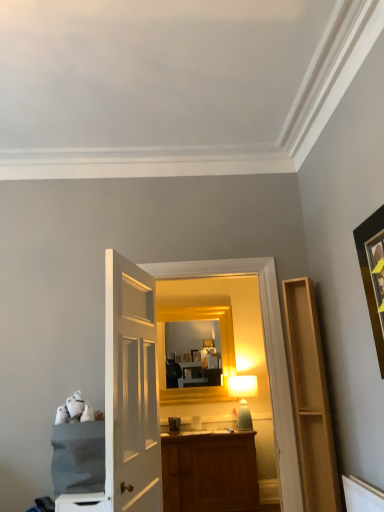
Question: From a real-world perspective, does light wood shelf at right, acting as the 1th cabinetry starting from the right, stand above black matte picture frame at upper right?

Choices:
 (A) yes
 (B) no

Answer: (B)

Question: Can you confirm if light wood shelf at right, acting as the 2th cabinetry starting from the left, is taller than black matte picture frame at upper right?

Choices:
 (A) no
 (B) yes

Answer: (B)

Question: Is light wood shelf at right, acting as the 2th cabinetry starting from the left, bigger than black matte picture frame at upper right?

Choices:
 (A) yes
 (B) no

Answer: (A)

Question: Is light wood shelf at right, acting as the 2th cabinetry starting from the left, positioned beyond the bounds of black matte picture frame at upper right?

Choices:
 (A) no
 (B) yes

Answer: (B)

Question: Can you confirm if light wood shelf at right, acting as the 2th cabinetry starting from the left, is shorter than black matte picture frame at upper right?

Choices:
 (A) yes
 (B) no

Answer: (B)

Question: Is light wood shelf at right, acting as the 1th cabinetry starting from the right, aimed at black matte picture frame at upper right?

Choices:
 (A) no
 (B) yes

Answer: (A)

Question: From the image's perspective, does matte white table lamp at center appear lower than denim fabric cabinet at left, the second cabinetry when ordered from right to left?

Choices:
 (A) no
 (B) yes

Answer: (B)

Question: Does matte white table lamp at center have a larger size compared to denim fabric cabinet at left, the second cabinetry when ordered from right to left?

Choices:
 (A) no
 (B) yes

Answer: (A)

Question: Is matte white table lamp at center to the right of denim fabric cabinet at left, the second cabinetry when ordered from right to left, from the viewer's perspective?

Choices:
 (A) no
 (B) yes

Answer: (B)

Question: Is matte white table lamp at center positioned far away from denim fabric cabinet at left, the second cabinetry when ordered from right to left?

Choices:
 (A) yes
 (B) no

Answer: (A)

Question: From the image's perspective, is matte white table lamp at center on denim fabric cabinet at left, the first cabinetry when ordered from left to right?

Choices:
 (A) yes
 (B) no

Answer: (B)

Question: Is matte white table lamp at center outside denim fabric cabinet at left, the first cabinetry when ordered from left to right?

Choices:
 (A) yes
 (B) no

Answer: (A)

Question: From a real-world perspective, is black matte picture frame at upper right below denim fabric cabinet at left, the second cabinetry when ordered from right to left?

Choices:
 (A) yes
 (B) no

Answer: (B)